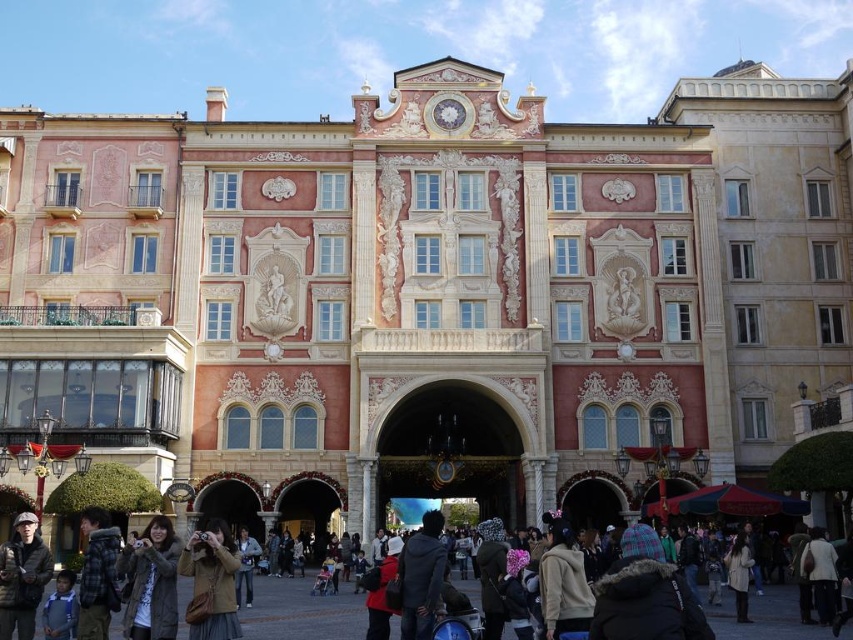
Consider the image. Who is higher up, matte black jackets at lower center or light beige fabric coat at lower right?

Positioned higher is light beige fabric coat at lower right.

Is point (729, 621) positioned after point (830, 557)?

No, (729, 621) is in front of (830, 557).

I want to click on matte black jackets at lower center, so click(300, 611).

Between point (20, 588) and point (740, 563), which one is positioned in front?

Point (20, 588) is more forward.

Where is `dark gray fabric jacket at lower left`? This screenshot has height=640, width=853. dark gray fabric jacket at lower left is located at coordinates (22, 577).

Between point (3, 609) and point (740, 579), which one is positioned behind?

Positioned behind is point (740, 579).

Locate an element on the screen. The height and width of the screenshot is (640, 853). dark gray fabric jacket at lower left is located at coordinates (22, 577).

Which is above, matte black jackets at lower center or beige fleece jacket at center?

beige fleece jacket at center is above.

Can you confirm if matte black jackets at lower center is positioned below beige fleece jacket at center?

Indeed, matte black jackets at lower center is positioned under beige fleece jacket at center.

You are a GUI agent. You are given a task and a screenshot of the screen. Output one action in this format:
    pyautogui.click(x=<x>, y=<y>)
    Task: Click on the matte black jackets at lower center
    This screenshot has width=853, height=640.
    Given the screenshot: What is the action you would take?
    pyautogui.click(x=300, y=611)